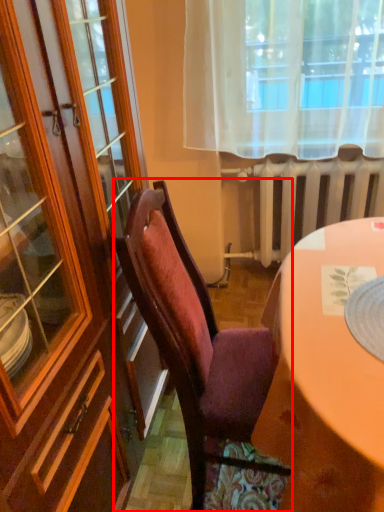
Question: Considering the relative positions of chair (annotated by the red box) and radiator in the image provided, where is chair (annotated by the red box) located with respect to the staircase?

Choices:
 (A) right
 (B) left

Answer: (B)